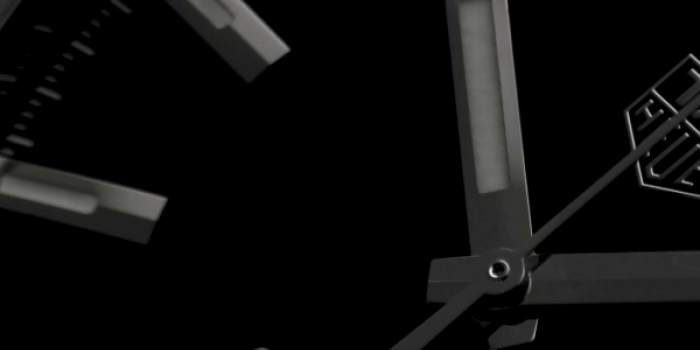
You are a GUI agent. You are given a task and a screenshot of the screen. Output one action in this format:
    pyautogui.click(x=<x>, y=<y>)
    Task: Click on the clock
    
    Given the screenshot: What is the action you would take?
    pyautogui.click(x=495, y=215)